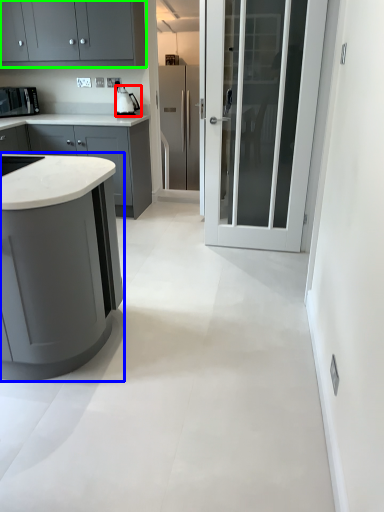
Question: Which is nearer to the kitchen appliance (highlighted by a red box)? cabinetry (highlighted by a blue box) or cabinetry (highlighted by a green box).

Choices:
 (A) cabinetry
 (B) cabinetry

Answer: (B)